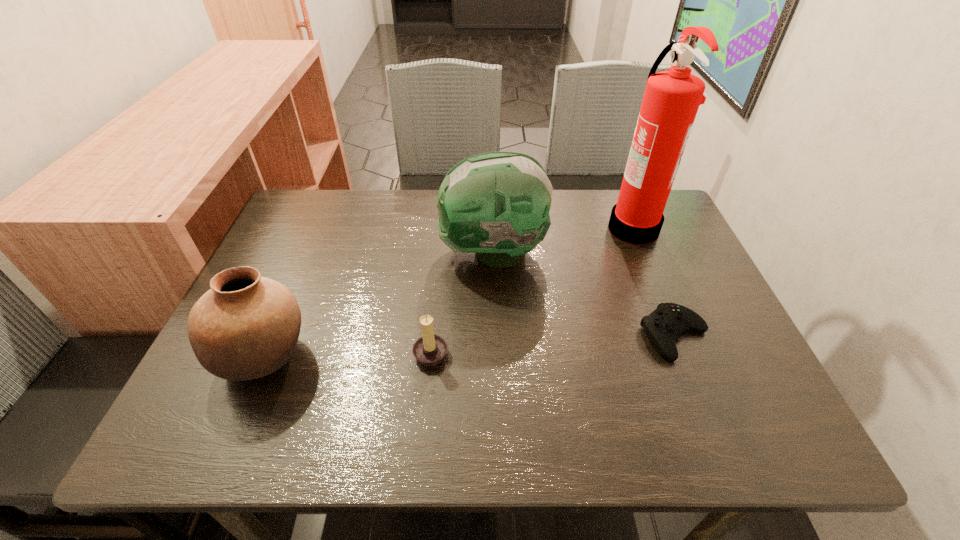
Image resolution: width=960 pixels, height=540 pixels. In order to click on fire extinguisher in this screenshot , I will do `click(671, 100)`.

Identify the location of football helmet. This screenshot has width=960, height=540. (496, 204).

Locate an element on the screen. The height and width of the screenshot is (540, 960). the leftmost object is located at coordinates (245, 327).

Locate an element on the screen. This screenshot has width=960, height=540. the third shortest object is located at coordinates (245, 327).

Where is `the fourth tallest object`? the fourth tallest object is located at coordinates (430, 349).

Find the location of a particular element. the shortest object is located at coordinates (667, 322).

The image size is (960, 540). Find the location of `free location located with the nozzle aimed from the fire extinguisher`. free location located with the nozzle aimed from the fire extinguisher is located at coordinates (513, 227).

Locate an element on the screen. blank area located 0.380m with the nozzle aimed from the fire extinguisher is located at coordinates tap(473, 227).

Locate an element on the screen. The image size is (960, 540). vacant space situated 0.230m with the nozzle aimed from the fire extinguisher is located at coordinates [526, 227].

Identify the location of free space located 0.110m on the visor of the football helmet. (396, 252).